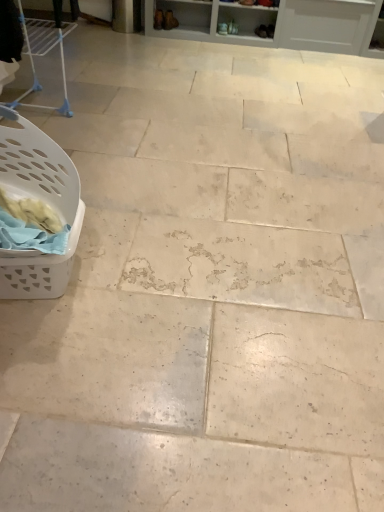
At what (x,y) coordinates should I click in order to perform the action: click on white plastic laundry basket at left. Please return your answer as a coordinate pair (x, y). The width and height of the screenshot is (384, 512). Looking at the image, I should click on (42, 200).

Locate an element on the screen. matte brown shoe at upper center, the 1th footwear viewed from the right is located at coordinates (262, 31).

Describe the element at coordinates (262, 31) in the screenshot. The width and height of the screenshot is (384, 512). I see `matte brown shoe at upper center, which is the second footwear from left to right` at that location.

You are a GUI agent. You are given a task and a screenshot of the screen. Output one action in this format:
    pyautogui.click(x=<x>, y=<y>)
    Task: Click on the white plastic laundry basket at left
    Image resolution: width=384 pixels, height=512 pixels.
    Given the screenshot: What is the action you would take?
    pyautogui.click(x=42, y=200)

Is white plastic laundry basket at left situated inside matte brown boot at upper center, acting as the first footwear starting from the left, or outside?

white plastic laundry basket at left is spatially situated outside matte brown boot at upper center, acting as the first footwear starting from the left.

Does white plastic laundry basket at left turn towards matte brown boot at upper center, the second footwear when ordered from right to left?

Yes, white plastic laundry basket at left is facing matte brown boot at upper center, the second footwear when ordered from right to left.

From a real-world perspective, is white plastic laundry basket at left over matte brown boot at upper center, acting as the first footwear starting from the left?

Yes, from a real-world perspective, white plastic laundry basket at left is on top of matte brown boot at upper center, acting as the first footwear starting from the left.

In terms of width, does matte brown shoe at upper center, the 1th footwear viewed from the right, look wider or thinner when compared to matte brown boot at upper center, the second footwear when ordered from right to left?

Considering their sizes, matte brown shoe at upper center, the 1th footwear viewed from the right, looks slimmer than matte brown boot at upper center, the second footwear when ordered from right to left.

Relative to matte brown boot at upper center, acting as the first footwear starting from the left, is matte brown shoe at upper center, which is the second footwear from left to right, in front or behind?

In the image, matte brown shoe at upper center, which is the second footwear from left to right, appears behind matte brown boot at upper center, acting as the first footwear starting from the left.

Considering the relative positions of matte brown shoe at upper center, which is the second footwear from left to right, and matte brown boot at upper center, the second footwear when ordered from right to left, in the image provided, is matte brown shoe at upper center, which is the second footwear from left to right, to the right of matte brown boot at upper center, the second footwear when ordered from right to left, from the viewer's perspective?

Yes, matte brown shoe at upper center, which is the second footwear from left to right, is to the right of matte brown boot at upper center, the second footwear when ordered from right to left.

Considering the relative positions of matte brown shoe at upper center, the 1th footwear viewed from the right, and white plastic laundry basket at left in the image provided, is matte brown shoe at upper center, the 1th footwear viewed from the right, in front of white plastic laundry basket at left?

No.

From the image's perspective, does matte brown shoe at upper center, the 1th footwear viewed from the right, appear higher than white plastic laundry basket at left?

Correct, matte brown shoe at upper center, the 1th footwear viewed from the right, appears higher than white plastic laundry basket at left in the image.

Considering the sizes of objects matte brown shoe at upper center, which is the second footwear from left to right, and white plastic laundry basket at left in the image provided, who is shorter, matte brown shoe at upper center, which is the second footwear from left to right, or white plastic laundry basket at left?

With less height is matte brown shoe at upper center, which is the second footwear from left to right.

Is point (260, 29) behind point (1, 169)?

Yes, point (260, 29) is farther from viewer.

Locate an element on the screen. The height and width of the screenshot is (512, 384). footwear above the matte brown shoe at upper center, the 1th footwear viewed from the right (from the image's perspective) is located at coordinates (169, 20).

Between matte brown boot at upper center, the second footwear when ordered from right to left, and matte brown shoe at upper center, which is the second footwear from left to right, which one is positioned in front?

matte brown boot at upper center, the second footwear when ordered from right to left, is more forward.

Is matte brown boot at upper center, the second footwear when ordered from right to left, directly adjacent to matte brown shoe at upper center, the 1th footwear viewed from the right?

There is a gap between matte brown boot at upper center, the second footwear when ordered from right to left, and matte brown shoe at upper center, the 1th footwear viewed from the right.

Which of these two, matte brown boot at upper center, acting as the first footwear starting from the left, or matte brown shoe at upper center, which is the second footwear from left to right, is thinner?

matte brown shoe at upper center, which is the second footwear from left to right, is thinner.

Considering the positions of objects matte brown boot at upper center, acting as the first footwear starting from the left, and white plastic laundry basket at left in the image provided, who is more to the left, matte brown boot at upper center, acting as the first footwear starting from the left, or white plastic laundry basket at left?

From the viewer's perspective, white plastic laundry basket at left appears more on the left side.

Is matte brown boot at upper center, the second footwear when ordered from right to left, oriented towards white plastic laundry basket at left?

Yes, matte brown boot at upper center, the second footwear when ordered from right to left, is facing white plastic laundry basket at left.

The height and width of the screenshot is (512, 384). Identify the location of footwear that is the 1st object located behind the white plastic laundry basket at left. (169, 20).

Is point (16, 181) more distant than point (262, 30)?

That is False.

Is white plastic laundry basket at left inside or outside of matte brown shoe at upper center, which is the second footwear from left to right?

The correct answer is: outside.

In the scene shown: Between white plastic laundry basket at left and matte brown shoe at upper center, which is the second footwear from left to right, which one has more height?

white plastic laundry basket at left.

Is the surface of white plastic laundry basket at left in direct contact with matte brown shoe at upper center, which is the second footwear from left to right?

white plastic laundry basket at left and matte brown shoe at upper center, which is the second footwear from left to right, are not in contact.

What are the coordinates of `basket below the matte brown boot at upper center, acting as the first footwear starting from the left (from the image's perspective)` in the screenshot? It's located at (42, 200).

The width and height of the screenshot is (384, 512). Identify the location of footwear behind the matte brown boot at upper center, the second footwear when ordered from right to left. (262, 31).

Estimate the real-world distances between objects in this image. Which object is further from white plastic laundry basket at left, matte brown boot at upper center, the second footwear when ordered from right to left, or matte brown shoe at upper center, which is the second footwear from left to right?

The object further to white plastic laundry basket at left is matte brown shoe at upper center, which is the second footwear from left to right.

Looking at the image, which one is located further to matte brown shoe at upper center, the 1th footwear viewed from the right, matte brown boot at upper center, the second footwear when ordered from right to left, or white plastic laundry basket at left?

white plastic laundry basket at left lies further to matte brown shoe at upper center, the 1th footwear viewed from the right, than the other object.

Based on their spatial positions, is white plastic laundry basket at left or matte brown shoe at upper center, the 1th footwear viewed from the right, closer to matte brown boot at upper center, the second footwear when ordered from right to left?

matte brown shoe at upper center, the 1th footwear viewed from the right.

Estimate the real-world distances between objects in this image. Which object is further from white plastic laundry basket at left, matte brown shoe at upper center, which is the second footwear from left to right, or matte brown boot at upper center, the second footwear when ordered from right to left?

Among the two, matte brown shoe at upper center, which is the second footwear from left to right, is located further to white plastic laundry basket at left.

Estimate the real-world distances between objects in this image. Which object is closer to matte brown shoe at upper center, the 1th footwear viewed from the right, white plastic laundry basket at left or matte brown boot at upper center, the second footwear when ordered from right to left?

matte brown boot at upper center, the second footwear when ordered from right to left, is positioned closer to the anchor matte brown shoe at upper center, the 1th footwear viewed from the right.

Based on their spatial positions, is matte brown shoe at upper center, the 1th footwear viewed from the right, or white plastic laundry basket at left closer to matte brown boot at upper center, the second footwear when ordered from right to left?

matte brown shoe at upper center, the 1th footwear viewed from the right.

The width and height of the screenshot is (384, 512). I want to click on footwear between white plastic laundry basket at left and matte brown shoe at upper center, the 1th footwear viewed from the right, from front to back, so click(169, 20).